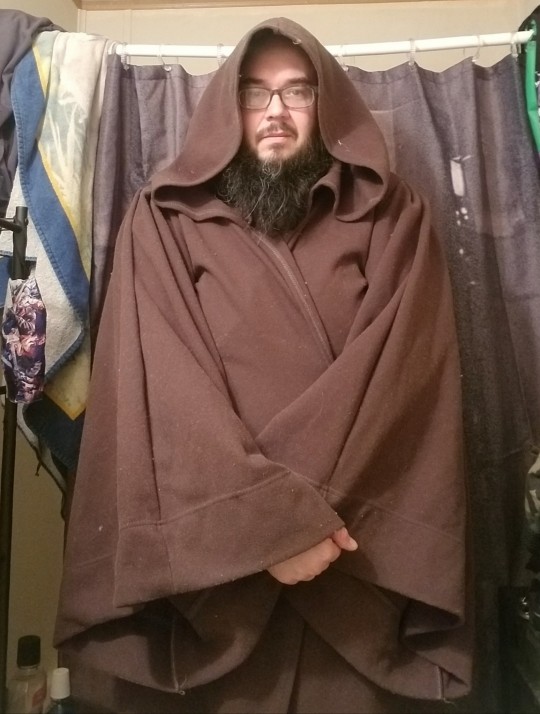
The image size is (540, 714). I want to click on robe, so click(x=394, y=396).